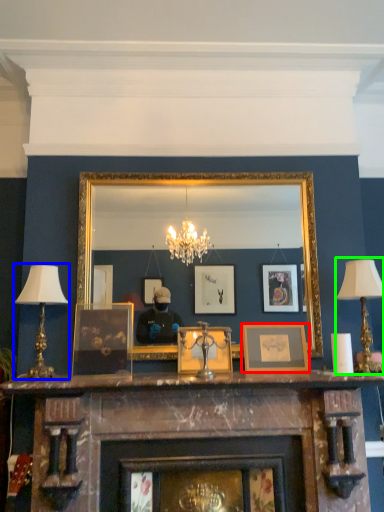
Question: Based on their relative distances, which object is farther from picture frame (highlighted by a red box)? Choose from table lamp (highlighted by a blue box) and table lamp (highlighted by a green box).

Choices:
 (A) table lamp
 (B) table lamp

Answer: (A)